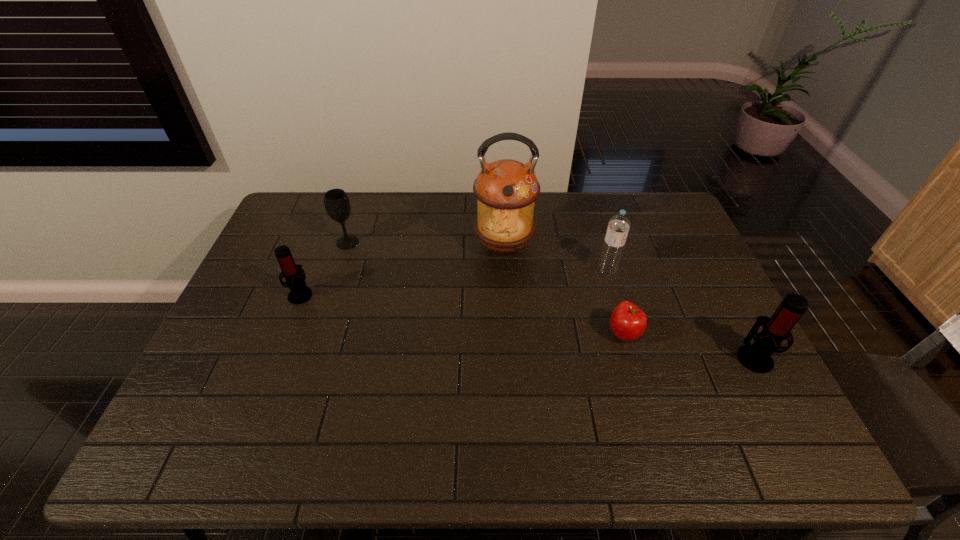
This screenshot has width=960, height=540. Identify the location of free space located 0.220m on the back of the taller microphone. (714, 281).

Where is `blank space located on the right of the second object from left to right`? This screenshot has width=960, height=540. blank space located on the right of the second object from left to right is located at coordinates [383, 242].

Where is `free region located 0.090m on the right of the water bottle`? free region located 0.090m on the right of the water bottle is located at coordinates (646, 270).

This screenshot has height=540, width=960. What are the coordinates of `free space located 0.110m on the front of the apple` in the screenshot? It's located at pos(638,387).

This screenshot has width=960, height=540. In order to click on vacant space located on the front of the oil lamp in this screenshot , I will do `click(507, 302)`.

Find the location of a particular element. object that is at the far edge is located at coordinates (506, 190).

At what (x,y) coordinates should I click in order to perform the action: click on object present at the left edge. Please return your answer as a coordinate pair (x, y). Looking at the image, I should click on (299, 293).

Locate an element on the screen. Image resolution: width=960 pixels, height=540 pixels. object that is positioned at the right edge is located at coordinates (757, 357).

This screenshot has width=960, height=540. In order to click on vacant position at the far edge of the desktop in this screenshot , I will do `click(436, 230)`.

I want to click on vacant region at the near edge of the desktop, so coord(408,403).